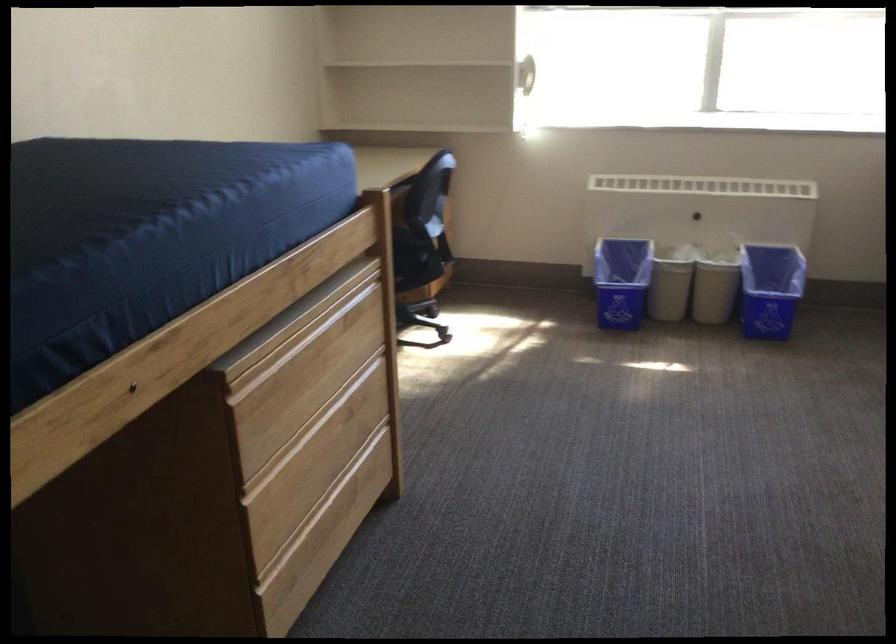
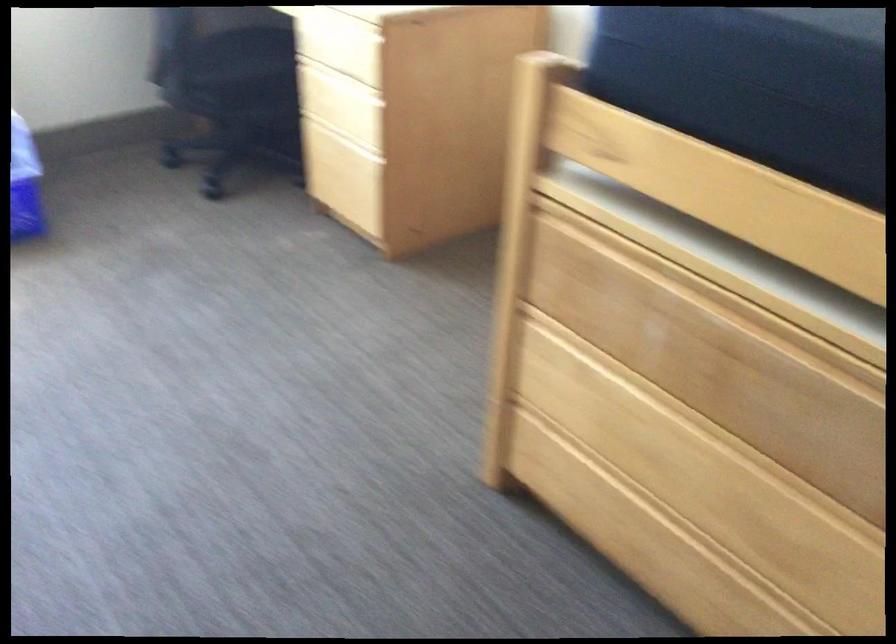
The images are taken continuously from a first-person perspective. In which direction is your viewpoint rotating?

The camera's rotation is toward right-down.